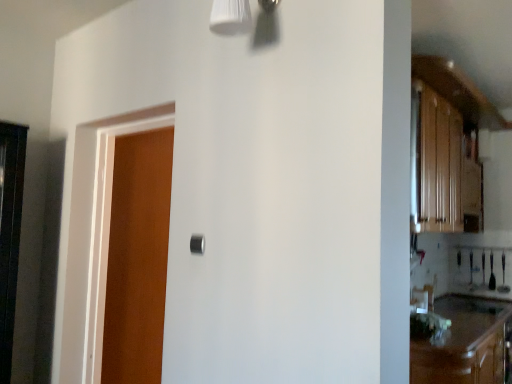
What do you see at coordinates (197, 244) in the screenshot? I see `black matte door handle at center` at bounding box center [197, 244].

What is the approximate height of black matte door handle at center?

black matte door handle at center is 8.26 centimeters tall.

Where is `brown wood cabinetry at lower right`? Image resolution: width=512 pixels, height=384 pixels. brown wood cabinetry at lower right is located at coordinates 466,343.

Image resolution: width=512 pixels, height=384 pixels. In order to click on black matte door handle at center in this screenshot , I will do `click(197, 244)`.

Identify the location of door handle above the wooden door at left (from the image's perspective). (197, 244).

How different are the orientations of black matte door handle at center and wooden door at left in degrees?

The angle between the facing direction of black matte door handle at center and the facing direction of wooden door at left is 178 degrees.

Consider the image. From a real-world perspective, is black matte door handle at center positioned over wooden door at left based on gravity?

Yes, from a real-world perspective, black matte door handle at center is over wooden door at left

Does point (195, 251) come farther from viewer compared to point (108, 280)?

That is False.

Can you tell me how much brown wood cabinetry at lower right and black matte door handle at center differ in facing direction?

There is a 89.2-degree angle between the facing directions of brown wood cabinetry at lower right and black matte door handle at center.

Is brown wood cabinetry at lower right facing towards black matte door handle at center?

No, brown wood cabinetry at lower right is not turned towards black matte door handle at center.

Considering the positions of objects brown wood cabinetry at lower right and black matte door handle at center in the image provided, who is more to the left, brown wood cabinetry at lower right or black matte door handle at center?

Positioned to the left is black matte door handle at center.

From a real-world perspective, which object stands above the other?

From a 3D spatial view, black matte door handle at center is above.

Identify the location of door on the left of black matte door handle at center. The height and width of the screenshot is (384, 512). (137, 258).

Is wooden door at left at the left side of black matte door handle at center?

Yes.

Between wooden door at left and black matte door handle at center, which one has smaller width?

Thinner between the two is black matte door handle at center.

From the image's perspective, between wooden door at left and black matte door handle at center, who is located below?

wooden door at left is shown below in the image.

From a real-world perspective, is brown wood cabinetry at lower right physically below wooden door at left?

Yes.

Can you confirm if brown wood cabinetry at lower right is positioned to the left of wooden door at left?

No, brown wood cabinetry at lower right is not to the left of wooden door at left.

This screenshot has height=384, width=512. I want to click on door behind the brown wood cabinetry at lower right, so click(x=137, y=258).

Are brown wood cabinetry at lower right and wooden door at left far apart?

Yes.

Considering the sizes of objects black matte door handle at center and brown wood cabinetry at lower right in the image provided, who is taller, black matte door handle at center or brown wood cabinetry at lower right?

brown wood cabinetry at lower right is taller.

In the image, is black matte door handle at center on the left side or the right side of brown wood cabinetry at lower right?

In the image, black matte door handle at center appears on the left side of brown wood cabinetry at lower right.

Which is closer, (196, 247) or (508, 366)?

The point (196, 247) is closer.

In the scene shown: From the image's perspective, between wooden door at left and brown wood cabinetry at lower right, who is located below?

brown wood cabinetry at lower right.

Which of these two, wooden door at left or brown wood cabinetry at lower right, is thinner?

wooden door at left.

Can you confirm if wooden door at left is smaller than brown wood cabinetry at lower right?

Correct, wooden door at left occupies less space than brown wood cabinetry at lower right.

Is wooden door at left positioned far away from brown wood cabinetry at lower right?

That's right, there is a large distance between wooden door at left and brown wood cabinetry at lower right.

Locate an element on the screen. Image resolution: width=512 pixels, height=384 pixels. door handle above the wooden door at left (from the image's perspective) is located at coordinates (197, 244).

Where is `door handle lying on the left of brown wood cabinetry at lower right`? door handle lying on the left of brown wood cabinetry at lower right is located at coordinates (197, 244).

Considering their positions, is black matte door handle at center positioned closer to brown wood cabinetry at lower right than wooden door at left?

black matte door handle at center lies closer to brown wood cabinetry at lower right than the other object.

When comparing their distances from brown wood cabinetry at lower right, does wooden door at left or black matte door handle at center seem further?

Among the two, wooden door at left is located further to brown wood cabinetry at lower right.

Considering their positions, is brown wood cabinetry at lower right positioned further to black matte door handle at center than wooden door at left?

Among the two, brown wood cabinetry at lower right is located further to black matte door handle at center.

In the scene shown: Considering their positions, is black matte door handle at center positioned closer to wooden door at left than brown wood cabinetry at lower right?

The object closer to wooden door at left is black matte door handle at center.

Based on their spatial positions, is wooden door at left or brown wood cabinetry at lower right closer to black matte door handle at center?

wooden door at left is closer to black matte door handle at center.

Considering their positions, is brown wood cabinetry at lower right positioned further to wooden door at left than black matte door handle at center?

Based on the image, brown wood cabinetry at lower right appears to be further to wooden door at left.

This screenshot has height=384, width=512. I want to click on door handle located between wooden door at left and brown wood cabinetry at lower right in the left-right direction, so click(x=197, y=244).